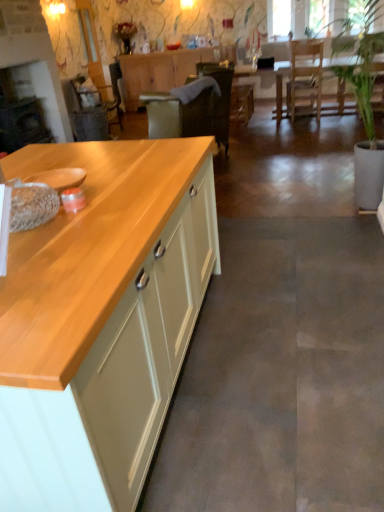
Question: Is matte wood cabinet at center, placed as the 2th cabinetry when sorted from front to back, thinner than wooden table at center?

Choices:
 (A) yes
 (B) no

Answer: (A)

Question: Is matte wood cabinet at center, placed as the 2th cabinetry when sorted from front to back, oriented towards wooden table at center?

Choices:
 (A) yes
 (B) no

Answer: (B)

Question: Can you see matte wood cabinet at center, the first cabinetry in the top-to-bottom sequence, touching wooden table at center?

Choices:
 (A) yes
 (B) no

Answer: (B)

Question: Does matte wood cabinet at center, the first cabinetry in the top-to-bottom sequence, have a greater width compared to wooden table at center?

Choices:
 (A) yes
 (B) no

Answer: (B)

Question: From a real-world perspective, is matte wood cabinet at center, which ranks as the first cabinetry in back-to-front order, positioned above or below wooden table at center?

Choices:
 (A) below
 (B) above

Answer: (B)

Question: Is matte wood cabinet at center, placed as the 2th cabinetry when sorted from front to back, taller or shorter than wooden table at center?

Choices:
 (A) short
 (B) tall

Answer: (B)

Question: Looking at their shapes, would you say matte wood cabinet at center, the first cabinetry in the top-to-bottom sequence, is wider or thinner than wooden table at center?

Choices:
 (A) wide
 (B) thin

Answer: (B)

Question: From the image's perspective, is matte wood cabinet at center, the second cabinetry in the bottom-to-top sequence, above or below wooden table at center?

Choices:
 (A) below
 (B) above

Answer: (B)

Question: From the image's perspective, relative to wooden armchair at left, is green leafy plant at right above or below?

Choices:
 (A) below
 (B) above

Answer: (A)

Question: Considering the positions of green leafy plant at right and wooden armchair at left in the image, is green leafy plant at right bigger or smaller than wooden armchair at left?

Choices:
 (A) small
 (B) big

Answer: (B)

Question: Relative to wooden armchair at left, is green leafy plant at right in front or behind?

Choices:
 (A) front
 (B) behind

Answer: (A)

Question: Looking at their shapes, would you say green leafy plant at right is wider or thinner than wooden armchair at left?

Choices:
 (A) wide
 (B) thin

Answer: (A)

Question: Is point (16, 440) closer or farther from the camera than point (276, 68)?

Choices:
 (A) closer
 (B) farther

Answer: (A)

Question: Is light wood/texture cabinet at left, the second cabinetry from the top, bigger or smaller than wooden table at center?

Choices:
 (A) small
 (B) big

Answer: (B)